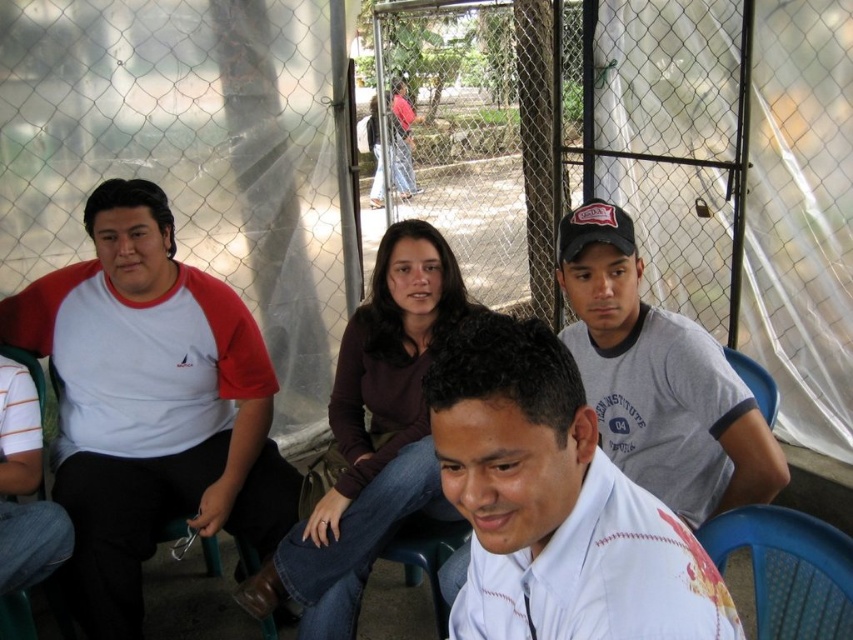
From the picture: Is white cotton shirt at left taller than white matte shirt at center?

Correct, white cotton shirt at left is much taller as white matte shirt at center.

Who is higher up, white cotton shirt at left or white matte shirt at center?

white cotton shirt at left

Identify the location of white cotton shirt at left. The image size is (853, 640). (149, 403).

Who is more distant from viewer, (653, 349) or (805, 634)?

The point (653, 349) is more distant.

Who is higher up, gray cotton t-shirt at upper right or blue plastic chair at lower right?

Positioned higher is gray cotton t-shirt at upper right.

Which is in front, point (666, 412) or point (780, 618)?

Point (780, 618) is more forward.

I want to click on gray cotton t-shirt at upper right, so click(659, 380).

Who is more forward, (622, 577) or (791, 520)?

Point (622, 577) is in front.

This screenshot has height=640, width=853. Identify the location of white matte shirt at center. (555, 502).

Find the location of `white matte shirt at center`. white matte shirt at center is located at coordinates (555, 502).